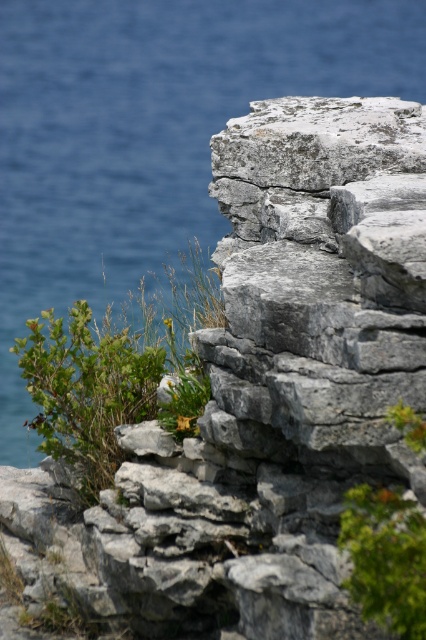
Looking at this image, is green leafy bush at center-left thinner than green leafy plant at lower right?

Incorrect, green leafy bush at center-left's width is not less than green leafy plant at lower right's.

Is green leafy bush at center-left taller than green leafy plant at lower right?

Correct, green leafy bush at center-left is much taller as green leafy plant at lower right.

Is point (129, 352) farther from camera compared to point (389, 490)?

Yes, it is.

Identify the location of green leafy bush at center-left. (115, 371).

Is blue water at upper left further to the viewer compared to green leafy bush at center-left?

Yes, it is behind green leafy bush at center-left.

Measure the distance between point (x=307, y=60) and camera.

A distance of 19.87 meters exists between point (x=307, y=60) and camera.

You are a GUI agent. You are given a task and a screenshot of the screen. Output one action in this format:
    pyautogui.click(x=<x>, y=<y>)
    Task: Click on the blue water at upper left
    
    Given the screenshot: What is the action you would take?
    (x=149, y=134)

Measure the distance from blue water at upper left to green leafy plant at lower right.

36.01 feet

Between blue water at upper left and green leafy plant at lower right, which one appears on the right side from the viewer's perspective?

Positioned to the right is green leafy plant at lower right.

Which is behind, point (2, 125) or point (408, 579)?

The point (2, 125) is behind.

This screenshot has height=640, width=426. I want to click on blue water at upper left, so click(149, 134).